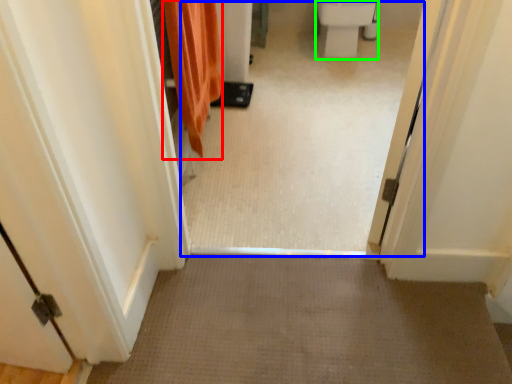
Question: Estimate the real-world distances between objects in this image. Which object is closer to shower curtain (highlighted by a red box), passage (highlighted by a blue box) or toilet bowl (highlighted by a green box)?

Choices:
 (A) passage
 (B) toilet bowl

Answer: (A)